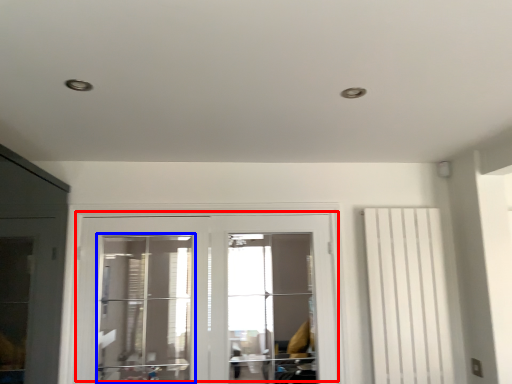
Question: Which of the following is the closest to the observer, door (highlighted by a red box) or window (highlighted by a blue box)?

Choices:
 (A) door
 (B) window

Answer: (A)